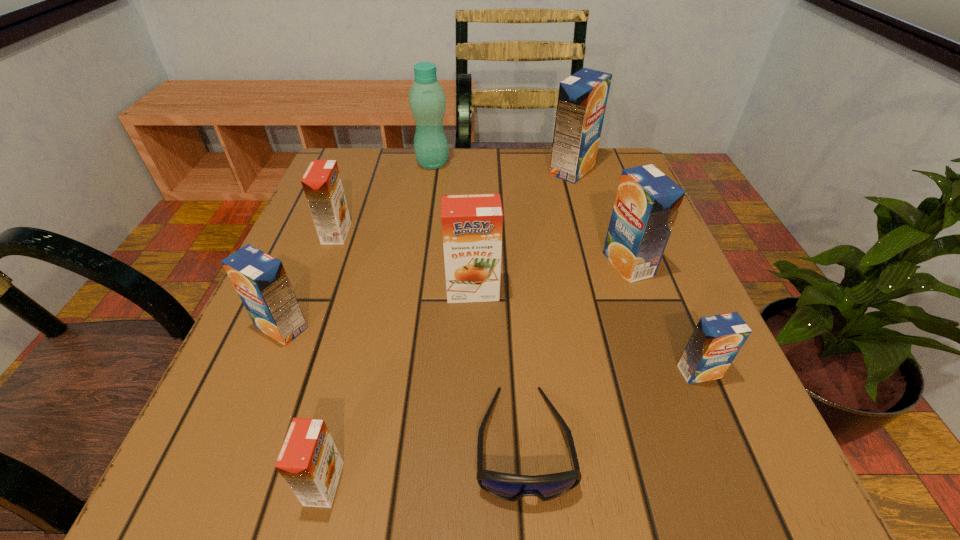
Identify the location of orange orange juice that can be found as the closest to the nearest orange juice. (472, 224).

The height and width of the screenshot is (540, 960). Find the location of `orange orange juice that is the second closest one to the third nearest blue orange_juice`. orange orange juice that is the second closest one to the third nearest blue orange_juice is located at coordinates (322, 185).

Where is `vacant space that satisfies the following two spatial constraints: 1. on the back side of the fourth orange juice from left to right; 2. on the left side of the fifth orange juice from right to left`? The image size is (960, 540). vacant space that satisfies the following two spatial constraints: 1. on the back side of the fourth orange juice from left to right; 2. on the left side of the fifth orange juice from right to left is located at coordinates (372, 291).

The image size is (960, 540). I want to click on blank space that satisfies the following two spatial constraints: 1. on the back side of the bottle; 2. on the left side of the seventh object from right to left, so [403, 163].

Identify the location of free space that satisfies the following two spatial constraints: 1. on the back side of the rightmost orange orange juice; 2. on the right side of the fourth nearest object. The image size is (960, 540). (298, 291).